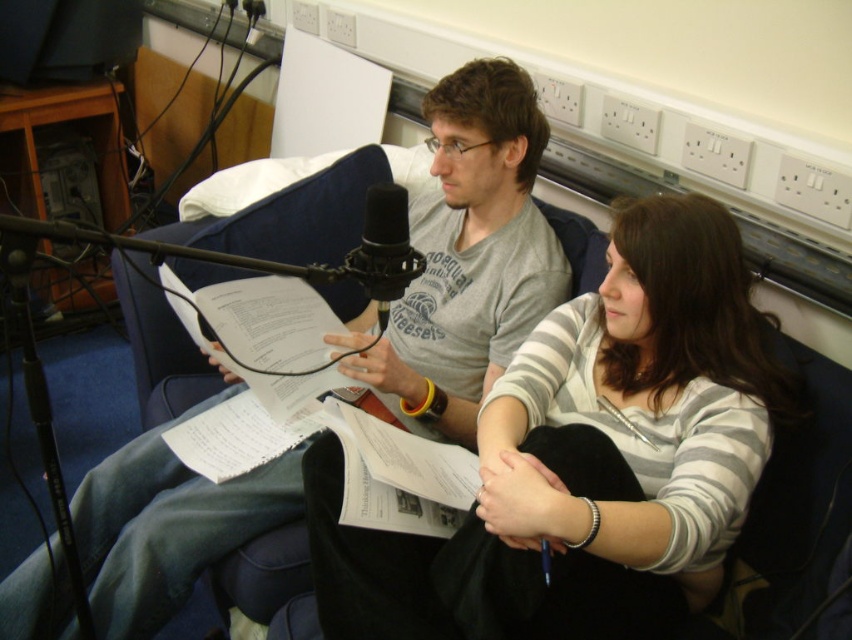
Is striped cotton sweater at center closer to the viewer compared to gray cotton t-shirt at center?

Yes, striped cotton sweater at center is closer to the viewer.

Consider the image. Can you confirm if striped cotton sweater at center is bigger than gray cotton t-shirt at center?

No, striped cotton sweater at center is not bigger than gray cotton t-shirt at center.

Which is in front, point (704, 464) or point (50, 576)?

Positioned in front is point (704, 464).

Locate an element on the screen. This screenshot has height=640, width=852. striped cotton sweater at center is located at coordinates (588, 458).

Between striped cotton sweater at center and black foam microphone at center, which one appears on the left side from the viewer's perspective?

black foam microphone at center

Between striped cotton sweater at center and black foam microphone at center, which one appears on the right side from the viewer's perspective?

striped cotton sweater at center

From the picture: Measure the distance between point (528, 554) and camera.

Point (528, 554) and camera are 3.42 feet apart from each other.

Where is `striped cotton sweater at center`? striped cotton sweater at center is located at coordinates (588, 458).

Between gray cotton t-shirt at center and black foam microphone at center, which one is positioned higher?

Positioned higher is black foam microphone at center.

Locate an element on the screen. This screenshot has width=852, height=640. gray cotton t-shirt at center is located at coordinates (470, 253).

This screenshot has height=640, width=852. I want to click on gray cotton t-shirt at center, so click(470, 253).